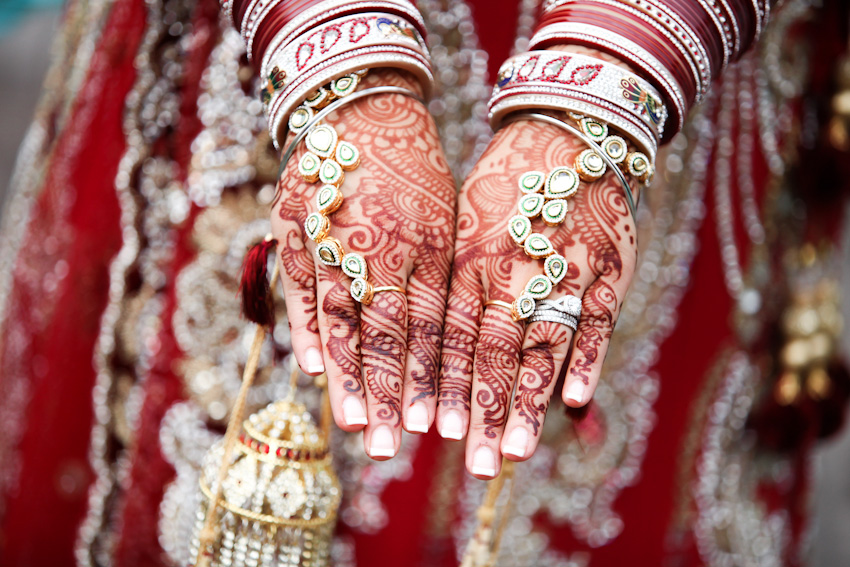
Find the location of a particular element. The width and height of the screenshot is (850, 567). red painting is located at coordinates (465, 299).